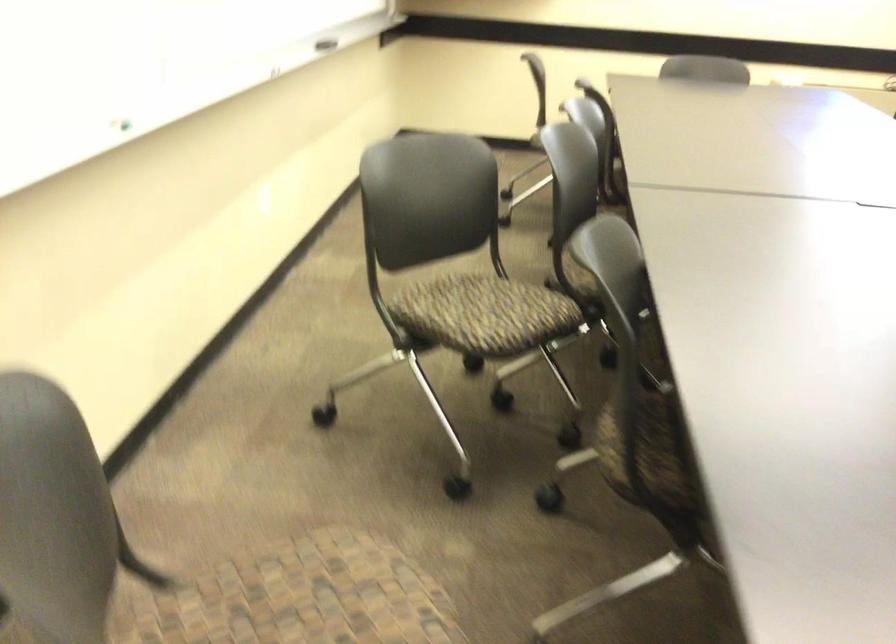
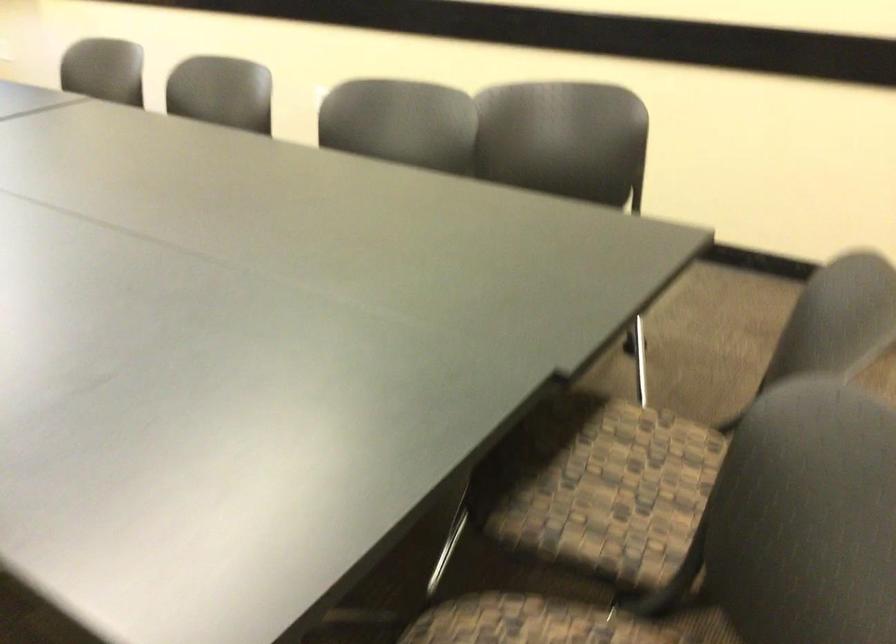
First-person continuous shooting, in which direction is the camera rotating?

The camera rotated toward right-down.